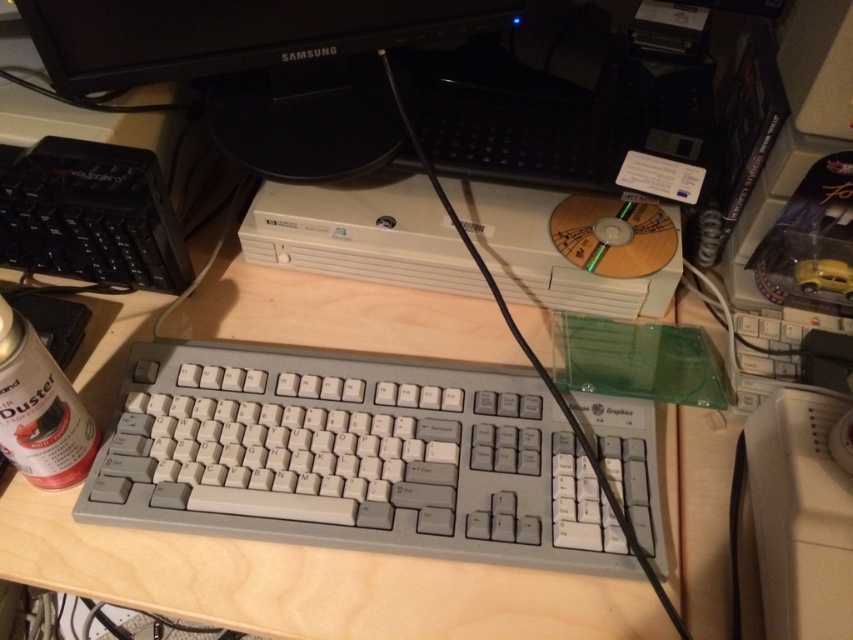
You are setting up a new desk and want to place the gray plastic keyboard at center and the black glossy monitor at upper center. The desk has limited space. What is the minimum distance you need between them to fit both items?

The minimum distance needed between the gray plastic keyboard at center and the black glossy monitor at upper center is 10.41 inches, as they are already positioned that far apart.

You are setting up a computer workstation and need to connect the gray plastic keyboard at center to the black glossy monitor at upper center. According to the image, where is the keyboard located relative to the monitor?

The gray plastic keyboard at center is below the black glossy monitor at upper center, so the keyboard is positioned underneath the monitor.

You are setting up a new desk and want to place the gray plastic keyboard at center and the black glossy monitor at upper center. Based on their sizes, which one should be placed first to ensure they both fit on the desk?

The gray plastic keyboard at center might be wider than black glossy monitor at upper center, so it should be placed first to ensure there is enough space for both.